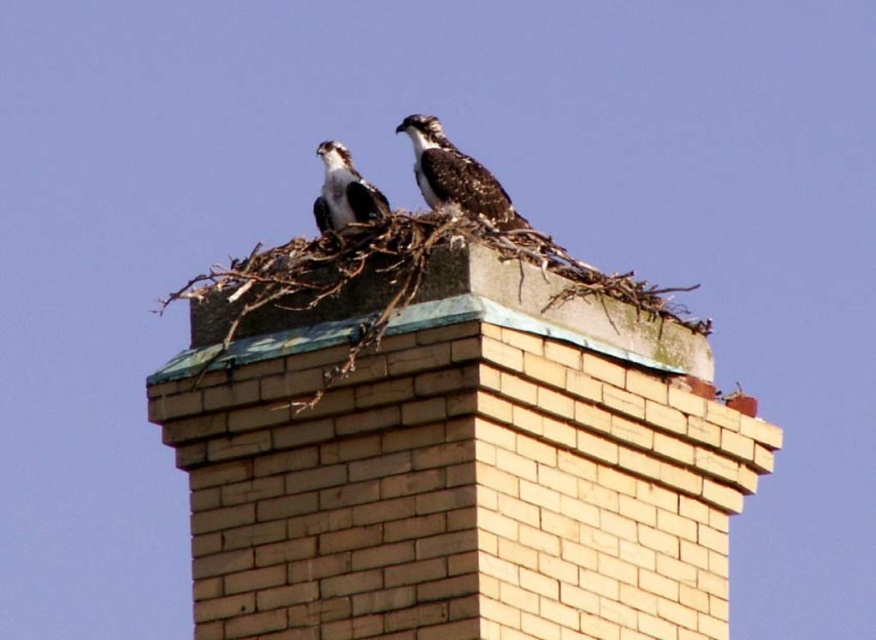
Is point (506, 280) closer to camera compared to point (371, 216)?

Yes.

Find the location of a particular element. beige brick chimney at center is located at coordinates (457, 465).

At what (x,y) coordinates should I click in order to perform the action: click on beige brick chimney at center. Please return your answer as a coordinate pair (x, y). The image size is (876, 640). Looking at the image, I should click on (457, 465).

This screenshot has height=640, width=876. What do you see at coordinates (457, 465) in the screenshot? I see `beige brick chimney at center` at bounding box center [457, 465].

Does beige brick chimney at center have a greater width compared to dark brown speckled feathers at center?

Indeed, beige brick chimney at center has a greater width compared to dark brown speckled feathers at center.

Is point (413, 625) farther from viewer compared to point (412, 132)?

No.

The image size is (876, 640). In order to click on beige brick chimney at center in this screenshot , I will do `click(457, 465)`.

Does dark brown speckled feathers at center appear under brown speckled feathers at center?

No, dark brown speckled feathers at center is not below brown speckled feathers at center.

Is point (429, 163) farther from viewer compared to point (357, 172)?

Yes, it is.

Who is more distant from viewer, (465,173) or (352,173)?

The point (465,173) is behind.

Identify the location of dark brown speckled feathers at center. (456, 176).